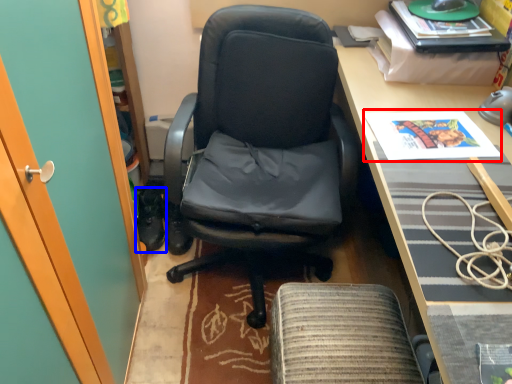
Question: Among these objects, which one is nearest to the camera, magazine (highlighted by a red box) or footwear (highlighted by a blue box)?

Choices:
 (A) magazine
 (B) footwear

Answer: (A)